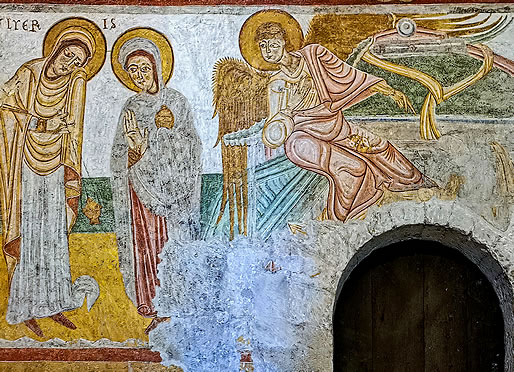
Image resolution: width=514 pixels, height=372 pixels. I want to click on color yellow paint on wall, so click(102, 271).